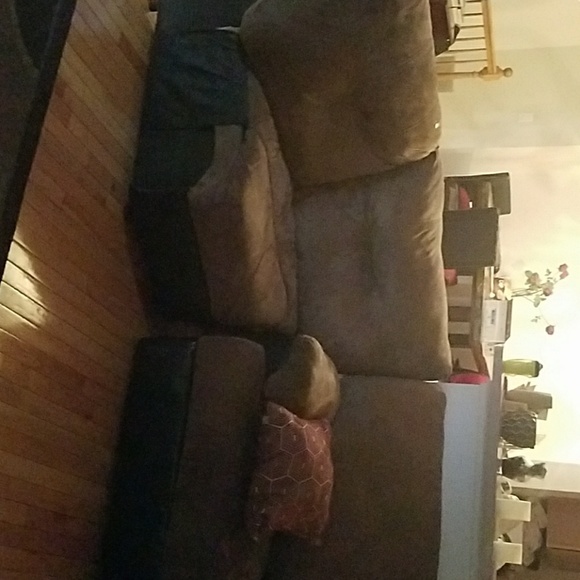
Where is `wooden floor`? The height and width of the screenshot is (580, 580). wooden floor is located at coordinates (72, 246).